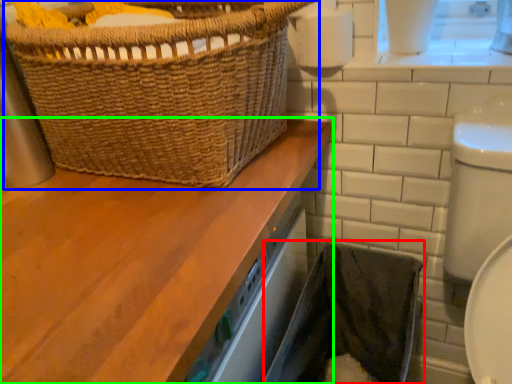
Question: Which is farther away from laundry basket (highlighted by a red box)? picnic basket (highlighted by a blue box) or bathroom cabinet (highlighted by a green box)?

Choices:
 (A) picnic basket
 (B) bathroom cabinet

Answer: (A)